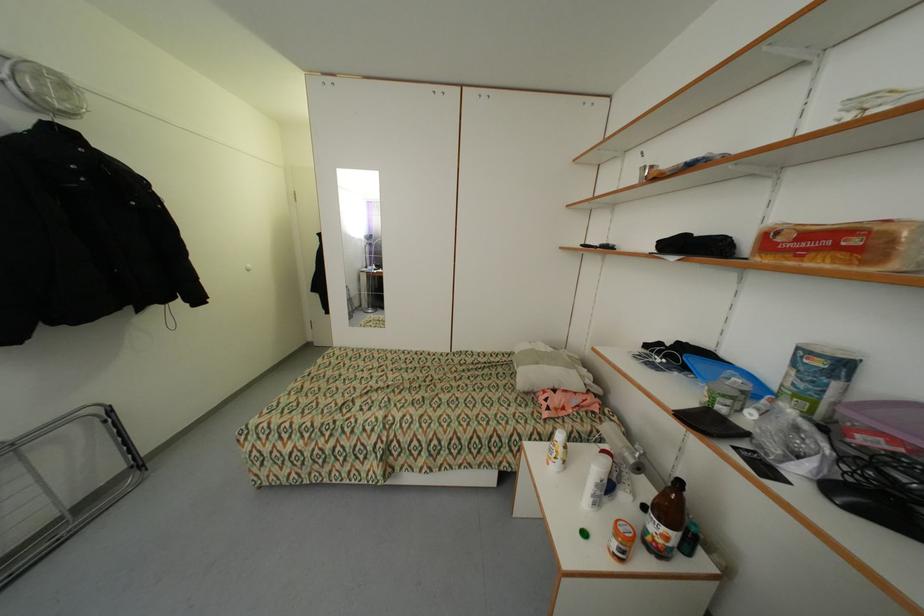
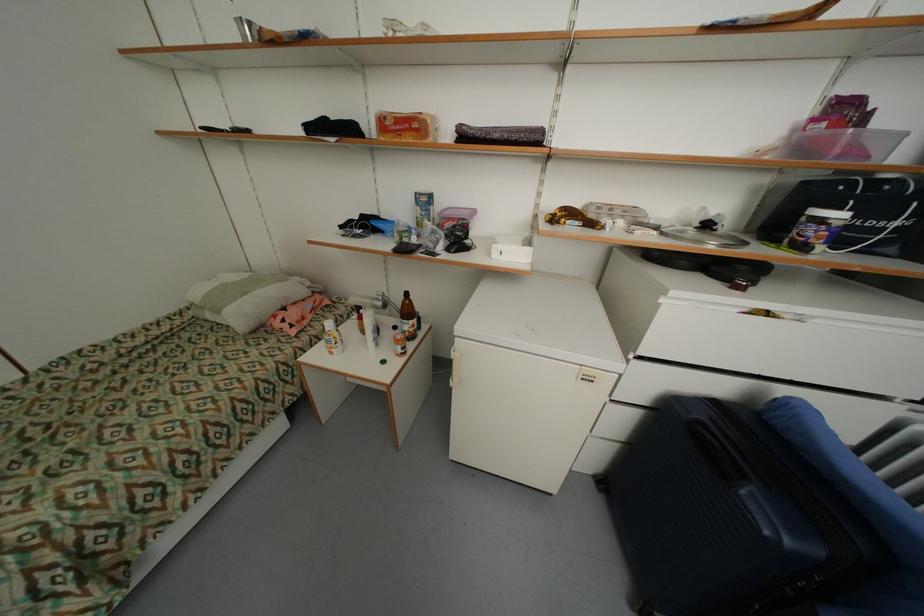
Find the pixel in the second image that matches the point at 860,241 in the first image.

(421, 126)